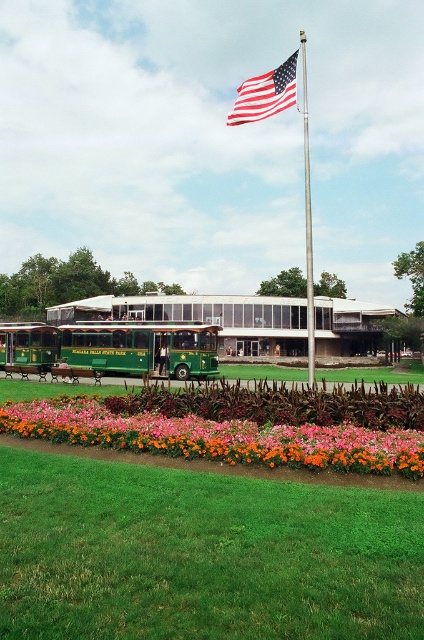
Question: Does american flag at upper center appear on the right side of green polished wood trolley at left?

Choices:
 (A) no
 (B) yes

Answer: (B)

Question: Can you confirm if green polished wood trolley at left is positioned below polished metal flag pole at center?

Choices:
 (A) yes
 (B) no

Answer: (A)

Question: Which point is closer to the camera taking this photo?

Choices:
 (A) (13, 326)
 (B) (307, 291)
 (C) (296, 51)
 (D) (130, 342)

Answer: (D)

Question: Which object is positioned farthest from the polished metal flag pole at center?

Choices:
 (A) american flag at upper center
 (B) green polished wood trolley at center
 (C) green polished wood trolley at left

Answer: (A)

Question: Does vibrant floral bed at center appear over polished metal flag pole at center?

Choices:
 (A) no
 (B) yes

Answer: (A)

Question: Which of these objects is positioned closest to the green polished wood trolley at center?

Choices:
 (A) vibrant floral bed at center
 (B) polished metal flag pole at center
 (C) green polished wood trolley at left

Answer: (C)